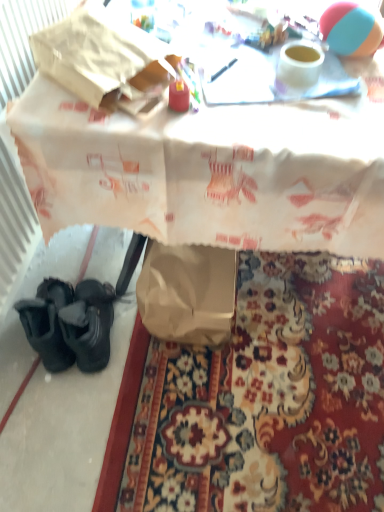
Question: From a real-world perspective, is white paper bag at lower left positioned under rubber beach ball at upper right based on gravity?

Choices:
 (A) yes
 (B) no

Answer: (A)

Question: Is white paper bag at lower left in contact with rubber beach ball at upper right?

Choices:
 (A) yes
 (B) no

Answer: (B)

Question: Is white paper bag at lower left to the right of rubber beach ball at upper right from the viewer's perspective?

Choices:
 (A) yes
 (B) no

Answer: (B)

Question: From a real-world perspective, is white paper bag at lower left on rubber beach ball at upper right?

Choices:
 (A) yes
 (B) no

Answer: (B)

Question: Is white paper bag at lower left facing away from rubber beach ball at upper right?

Choices:
 (A) no
 (B) yes

Answer: (A)

Question: In terms of width, does rubber beach ball at upper right look wider or thinner when compared to brown paper bag at lower left?

Choices:
 (A) wide
 (B) thin

Answer: (B)

Question: Relative to brown paper bag at lower left, is rubber beach ball at upper right in front or behind?

Choices:
 (A) front
 (B) behind

Answer: (A)

Question: From the image's perspective, relative to brown paper bag at lower left, is rubber beach ball at upper right above or below?

Choices:
 (A) above
 (B) below

Answer: (A)

Question: In terms of height, does rubber beach ball at upper right look taller or shorter compared to brown paper bag at lower left?

Choices:
 (A) short
 (B) tall

Answer: (B)

Question: Based on their sizes in the image, would you say brown paper bag at lower left is bigger or smaller than white paper bag at lower left?

Choices:
 (A) big
 (B) small

Answer: (B)

Question: Based on their positions, is brown paper bag at lower left located to the left or right of white paper bag at lower left?

Choices:
 (A) right
 (B) left

Answer: (B)

Question: Is brown paper bag at lower left situated inside white paper bag at lower left or outside?

Choices:
 (A) inside
 (B) outside

Answer: (B)

Question: From a real-world perspective, is brown paper bag at lower left above or below white paper bag at lower left?

Choices:
 (A) below
 (B) above

Answer: (A)

Question: From the image's perspective, is white paper bag at lower left above or below rubber beach ball at upper right?

Choices:
 (A) above
 (B) below

Answer: (B)

Question: Is point (241, 204) closer or farther from the camera than point (332, 14)?

Choices:
 (A) closer
 (B) farther

Answer: (A)